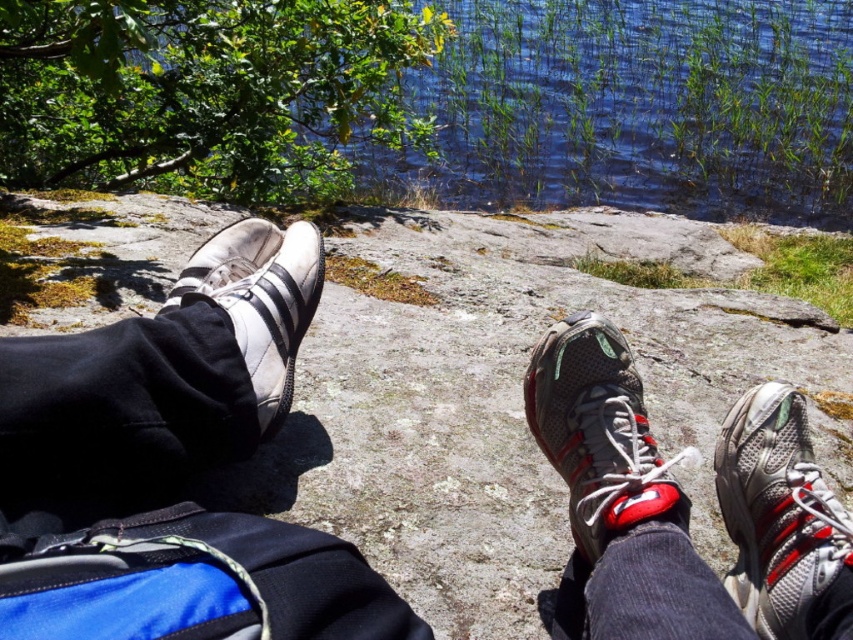
Who is higher up, gray mesh shoe at center or white leather shoe at left?

white leather shoe at left

Can you confirm if gray mesh shoe at center is wider than white leather shoe at left?

No.

From the picture: Measure the distance between gray mesh shoe at center and camera.

A distance of 26.85 inches exists between gray mesh shoe at center and camera.

Locate an element on the screen. This screenshot has width=853, height=640. gray mesh shoe at center is located at coordinates (598, 433).

Is white leather sneakers at lower center taller than white leather shoe at left?

Indeed, white leather sneakers at lower center has a greater height compared to white leather shoe at left.

Which of these two, white leather sneakers at lower center or white leather shoe at left, stands taller?

Standing taller between the two is white leather sneakers at lower center.

The width and height of the screenshot is (853, 640). I want to click on white leather sneakers at lower center, so click(x=173, y=465).

Is silver mesh shoe at lower right bigger than gray mesh shoe at center?

No.

Image resolution: width=853 pixels, height=640 pixels. Identify the location of silver mesh shoe at lower right. (778, 513).

Where is `silver mesh shoe at lower right`? The width and height of the screenshot is (853, 640). silver mesh shoe at lower right is located at coordinates (778, 513).